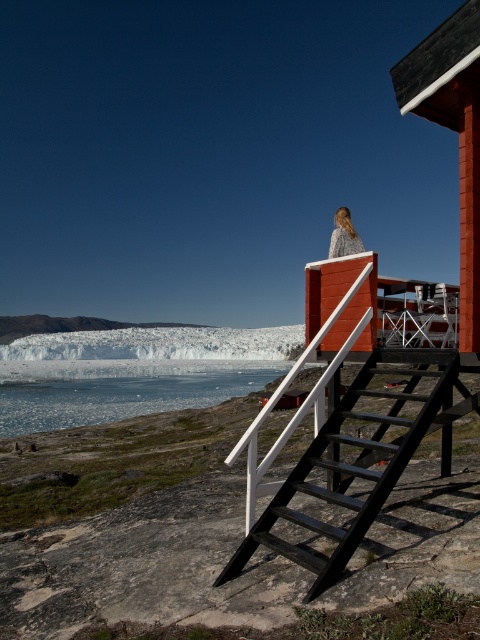
You are standing at the base of the black wooden stairs with white railings leading to the red cabin. You notice two points marked in the scene. Which of the two points, point (476, 29) or point (41, 339), is closer to your current position?

Point (476, 29) is closer to the camera than point (41, 339), so it is closer to your current position.

You are a hiker who wants to reach the smooth wood cabin at upper right from the white ice at lower left. Which direction should you head towards?

The smooth wood cabin at upper right is positioned on the right side of white ice at lower left, so you should head towards the right direction to reach the cabin.

You are standing at the origin point of the coordinate system in the image. The smooth wood cabin at upper right is at coordinates 0.205, 0.948. If you want to reach the cabin, in which general direction should you move from your current position?

The smooth wood cabin at upper right is located at coordinates (455, 131), so you should move towards the upper right direction to reach it.